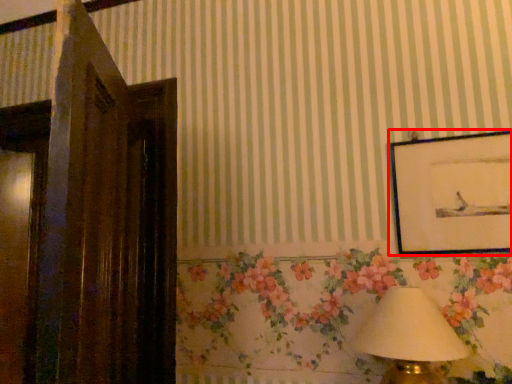
Question: Where is picture frame (annotated by the red box) located in relation to table lamp in the image?

Choices:
 (A) right
 (B) left

Answer: (A)